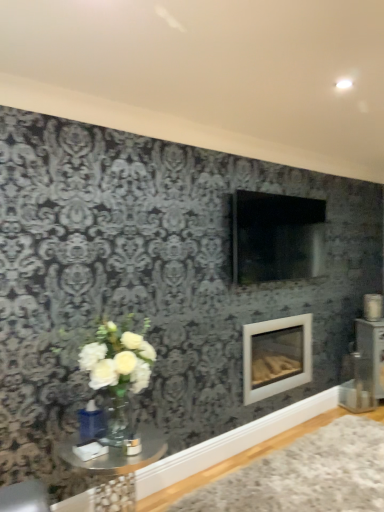
Where is `white glossy fireplace at center`? white glossy fireplace at center is located at coordinates (276, 356).

Measure the distance between clear glass table at lower left and camera.

The depth of clear glass table at lower left is 6.22 feet.

Locate an element on the screen. This screenshot has width=384, height=512. clear glass table at lower left is located at coordinates (111, 473).

Where is `white glossy fireplace at center`? Image resolution: width=384 pixels, height=512 pixels. white glossy fireplace at center is located at coordinates (276, 356).

Does clear glass table at lower left appear on the left side of white plush rug at lower right?

Yes, clear glass table at lower left is to the left of white plush rug at lower right.

Consider the image. Considering the relative sizes of clear glass table at lower left and white plush rug at lower right in the image provided, is clear glass table at lower left wider than white plush rug at lower right?

No.

Could you tell me if clear glass table at lower left is turned towards white plush rug at lower right?

No, clear glass table at lower left is not oriented towards white plush rug at lower right.

Is white glossy fireplace at center oriented towards white plush rug at lower right?

No, white glossy fireplace at center is not oriented towards white plush rug at lower right.

Which is in front, point (303, 346) or point (300, 433)?

The point (300, 433) is closer.

At what (x,y) coordinates should I click in order to perform the action: click on plain on the right of white glossy fireplace at center. Please return your answer as a coordinate pair (x, y). Looking at the image, I should click on (305, 475).

Based on their sizes in the image, would you say white glossy fireplace at center is bigger or smaller than white plush rug at lower right?

white glossy fireplace at center is bigger than white plush rug at lower right.

Based on their sizes in the image, would you say white glossy fireplace at center is bigger or smaller than clear glass table at lower left?

Clearly, white glossy fireplace at center is larger in size than clear glass table at lower left.

Is white glossy fireplace at center wider or thinner than clear glass table at lower left?

white glossy fireplace at center is thinner than clear glass table at lower left.

Which point is more forward, (270, 330) or (139, 428)?

The point (139, 428) is closer.

How distant is white glossy fireplace at center from clear glass table at lower left?

The distance of white glossy fireplace at center from clear glass table at lower left is 4.40 feet.

Is point (279, 483) positioned before point (87, 490)?

That is False.

In the scene shown: Is white plush rug at lower right facing away from clear glass table at lower left?

No, white plush rug at lower right's orientation is not away from clear glass table at lower left.

Based on their positions, is white plush rug at lower right located to the left or right of clear glass table at lower left?

white plush rug at lower right is positioned on clear glass table at lower left's right side.

Considering the positions of objects white plush rug at lower right and clear glass table at lower left in the image provided, who is behind, white plush rug at lower right or clear glass table at lower left?

white plush rug at lower right is further away from the camera.

Looking at this image, considering the positions of objects white plush rug at lower right and white glossy fireplace at center in the image provided, who is more to the left, white plush rug at lower right or white glossy fireplace at center?

white glossy fireplace at center.

Which object is wider, white plush rug at lower right or white glossy fireplace at center?

white plush rug at lower right.

Can you tell me how much white plush rug at lower right and white glossy fireplace at center differ in facing direction?

white plush rug at lower right and white glossy fireplace at center are facing 0.339 degrees away from each other.

Image resolution: width=384 pixels, height=512 pixels. I want to click on fireplace that is above the clear glass table at lower left (from the image's perspective), so click(276, 356).

Is clear glass table at lower left looking in the opposite direction of white glossy fireplace at center?

No, clear glass table at lower left's orientation is not away from white glossy fireplace at center.

Is clear glass table at lower left in front of or behind white glossy fireplace at center in the image?

clear glass table at lower left is in front of white glossy fireplace at center.

Is clear glass table at lower left thinner than white glossy fireplace at center?

In fact, clear glass table at lower left might be wider than white glossy fireplace at center.

I want to click on plain below the clear glass table at lower left (from the image's perspective), so click(x=305, y=475).

You are a GUI agent. You are given a task and a screenshot of the screen. Output one action in this format:
    pyautogui.click(x=<x>, y=<y>)
    Task: Click on the fireplace behind the white plush rug at lower right
    The image size is (384, 512).
    Given the screenshot: What is the action you would take?
    click(x=276, y=356)

Which object lies nearer to the anchor point clear glass table at lower left, white glossy fireplace at center or white plush rug at lower right?

A: The object closer to clear glass table at lower left is white plush rug at lower right.

Estimate the real-world distances between objects in this image. Which object is closer to white plush rug at lower right, white glossy fireplace at center or clear glass table at lower left?

white glossy fireplace at center.

Considering their positions, is clear glass table at lower left positioned further to white plush rug at lower right than white glossy fireplace at center?

clear glass table at lower left is positioned further to the anchor white plush rug at lower right.

From the image, which object appears to be farther from white glossy fireplace at center, clear glass table at lower left or white plush rug at lower right?

clear glass table at lower left.

Which object lies further to the anchor point clear glass table at lower left, white plush rug at lower right or white glossy fireplace at center?

The object further to clear glass table at lower left is white glossy fireplace at center.

When comparing their distances from white glossy fireplace at center, does white plush rug at lower right or clear glass table at lower left seem closer?

Based on the image, white plush rug at lower right appears to be nearer to white glossy fireplace at center.

Find the location of a particular element. The width and height of the screenshot is (384, 512). plain between clear glass table at lower left and white glossy fireplace at center from front to back is located at coordinates (305, 475).